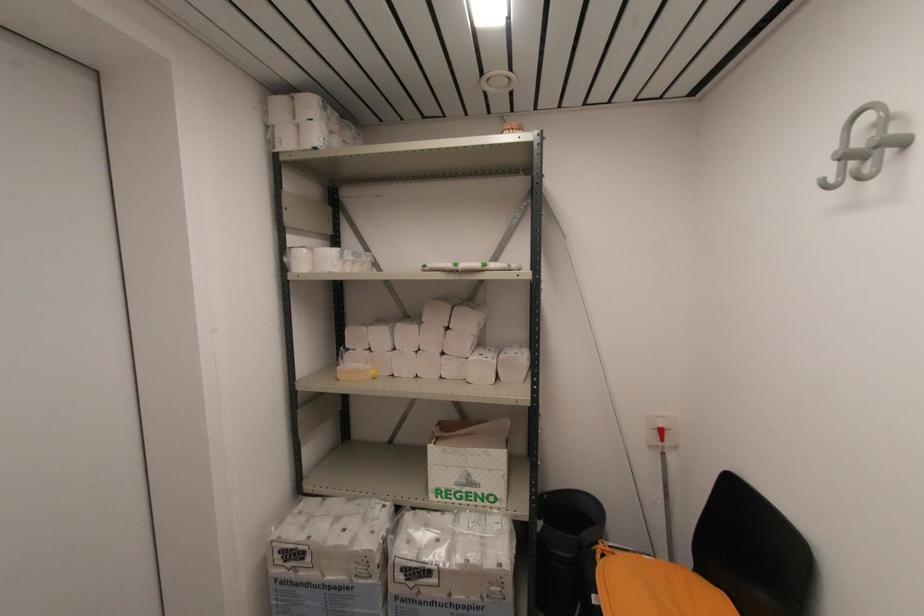
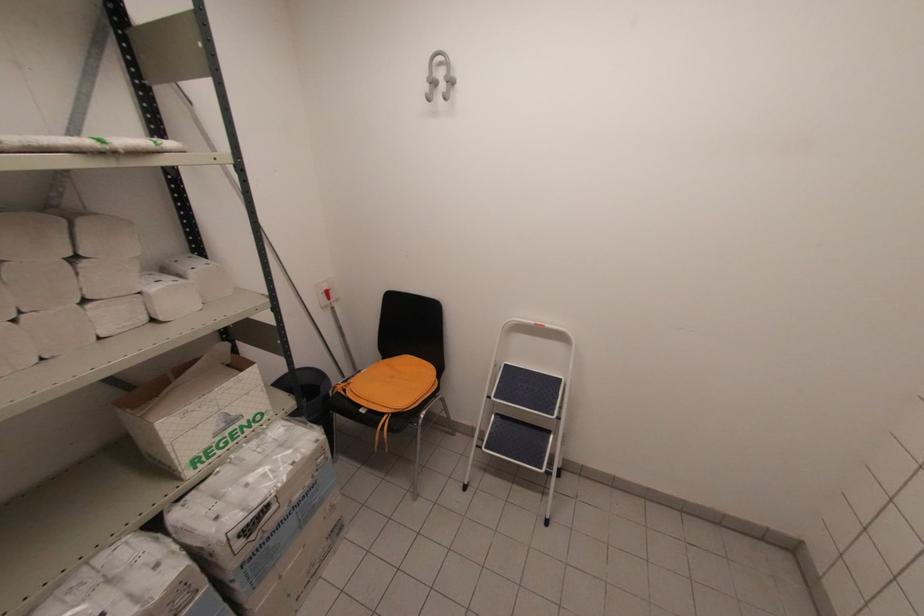
In the second image, find the point that corresponds to [465,480] in the first image.

(224, 426)